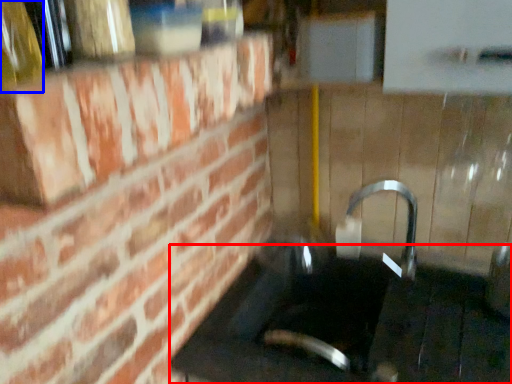
Question: Which object is further to the camera taking this photo, counter top (highlighted by a red box) or bottle (highlighted by a blue box)?

Choices:
 (A) counter top
 (B) bottle

Answer: (A)